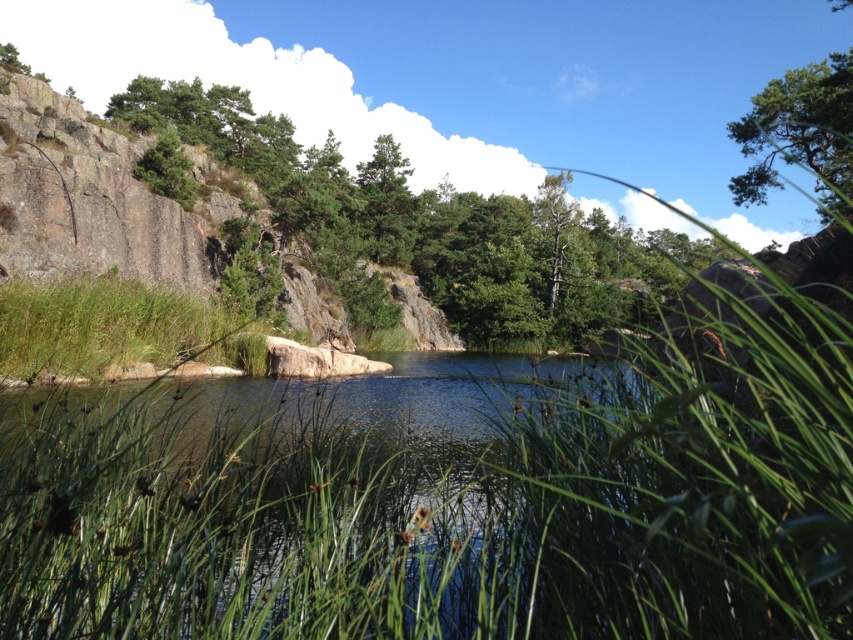
Which is behind, point (199, 436) or point (42, 298)?

The point (42, 298) is behind.

Who is lower down, green grassy river at center or green grass at lower left?

green grassy river at center is lower down.

Who is more distant from viewer, (207,538) or (59,328)?

Point (59,328)

Identify the location of green grassy river at center. This screenshot has height=640, width=853. (277, 508).

Is green grassy river at center thinner than green textured tree at upper right?

Indeed, green grassy river at center has a lesser width compared to green textured tree at upper right.

The image size is (853, 640). I want to click on green grassy river at center, so click(x=277, y=508).

This screenshot has height=640, width=853. What do you see at coordinates (277, 508) in the screenshot?
I see `green grassy river at center` at bounding box center [277, 508].

At what (x,y) coordinates should I click in order to perform the action: click on green grassy river at center. Please return your answer as a coordinate pair (x, y). Looking at the image, I should click on (277, 508).

Does green leafy tree at upper left appear on the right side of green textured tree at upper right?

Incorrect, green leafy tree at upper left is not on the right side of green textured tree at upper right.

Does green leafy tree at upper left have a larger size compared to green textured tree at upper right?

Yes.

The width and height of the screenshot is (853, 640). Find the location of `green leafy tree at upper left`. green leafy tree at upper left is located at coordinates click(x=432, y=224).